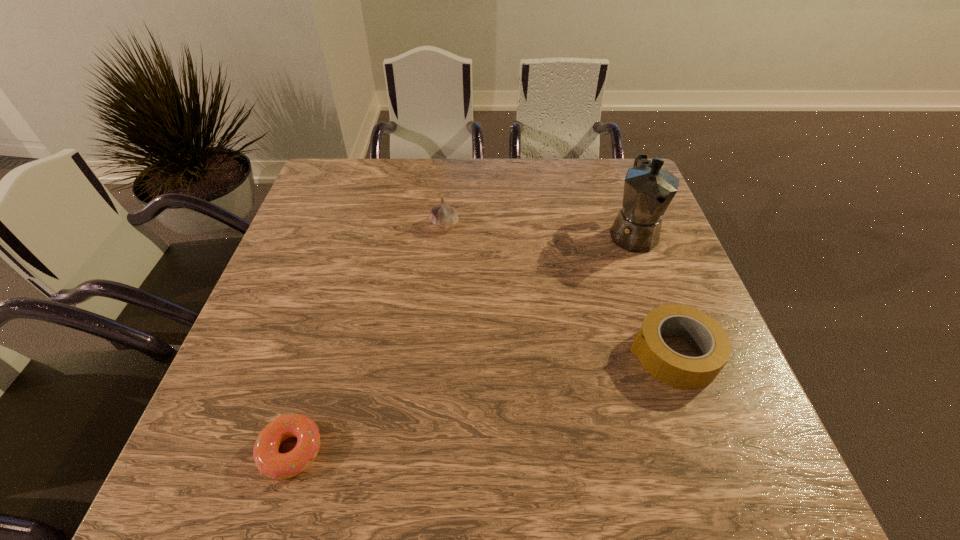
Where is `vacant space located 0.160m at the edge of the third tallest object`? The height and width of the screenshot is (540, 960). vacant space located 0.160m at the edge of the third tallest object is located at coordinates point(554,354).

You are a GUI agent. You are given a task and a screenshot of the screen. Output one action in this format:
    pyautogui.click(x=<x>, y=<y>)
    Task: Click on the vacant area located 0.210m at the edge of the third tallest object
    The width and height of the screenshot is (960, 540).
    Given the screenshot: What is the action you would take?
    pyautogui.click(x=530, y=354)

Where is `free space located 0.360m on the right of the nearest object`? The width and height of the screenshot is (960, 540). free space located 0.360m on the right of the nearest object is located at coordinates (526, 451).

At what (x,y) coordinates should I click in order to perform the action: click on object that is positioned at the near edge. Please return your answer as a coordinate pair (x, y). The height and width of the screenshot is (540, 960). Looking at the image, I should click on (271, 463).

You are a GUI agent. You are given a task and a screenshot of the screen. Output one action in this format:
    pyautogui.click(x=<x>, y=<y>)
    Task: Click on the object that is at the left edge
    Image resolution: width=960 pixels, height=540 pixels.
    Given the screenshot: What is the action you would take?
    pyautogui.click(x=271, y=463)

Image resolution: width=960 pixels, height=540 pixels. What are the coordinates of `coffeepot that is at the right edge` in the screenshot? It's located at (649, 189).

Locate an element on the screen. The image size is (960, 540). duct tape that is at the right edge is located at coordinates (679, 371).

Where is `object located at the near left corner`? Image resolution: width=960 pixels, height=540 pixels. object located at the near left corner is located at coordinates (271, 463).

In the image, there is a desktop. In order to click on vacant space at the far edge in this screenshot , I will do `click(567, 197)`.

I want to click on vacant point at the near edge, so click(x=415, y=474).